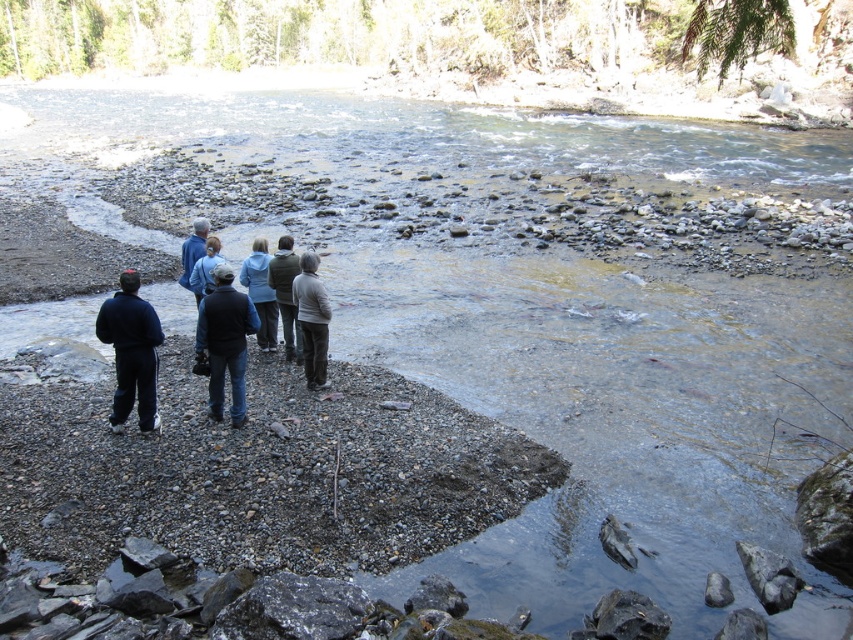
Question: Does dark gray sweater at center appear on the left side of blue fleece jacket at center?

Choices:
 (A) no
 (B) yes

Answer: (A)

Question: Which is nearer to the light brown sweater at center?

Choices:
 (A) dark blue jacket at center
 (B) dark gray sweater at center

Answer: (B)

Question: Where is light gray sweater at center located in relation to blue fleece jacket at center in the image?

Choices:
 (A) right
 (B) left

Answer: (A)

Question: Is dark gray sweater at center further to camera compared to blue denim jacket at center?

Choices:
 (A) no
 (B) yes

Answer: (A)

Question: Which point is closer to the camera?

Choices:
 (A) (146, 340)
 (B) (308, 314)

Answer: (A)

Question: Based on their relative distances, which object is nearer to the light brown sweater at center?

Choices:
 (A) dark blue jacket at center
 (B) dark gray sweater at center
 (C) light gray sweater at center

Answer: (B)